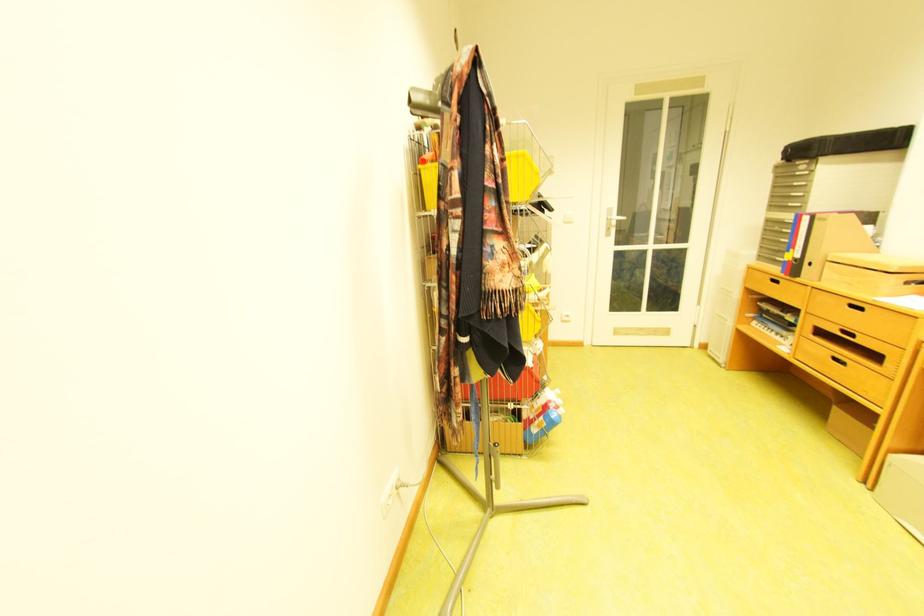
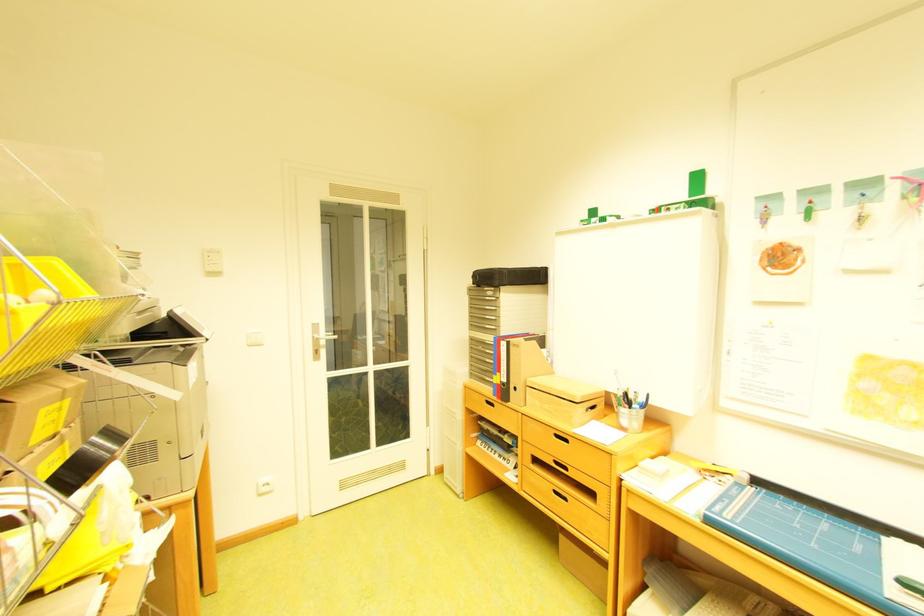
Where in the second image is the point corresponding to point (832, 140) from the first image?

(511, 272)